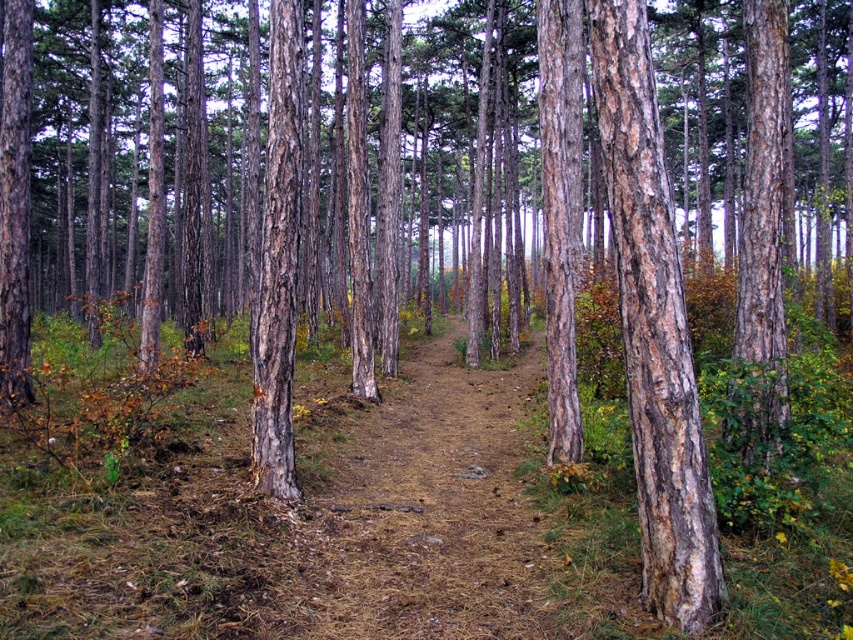
You are a hiker standing at the edge of the forest. You see the brown dirt trail at center and the smooth brown bark at center. Which object is closer to you?

The brown dirt trail at center is closer to you because it is further to the viewer than the smooth brown bark at center.